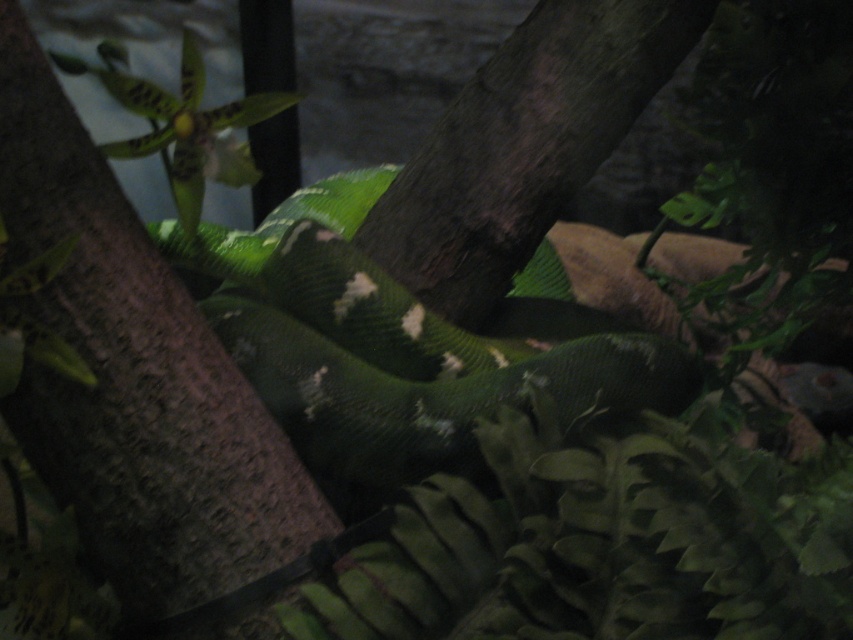
You are standing in front of a terrarium and notice a green snake coiled around a tree trunk. There is a point at coordinates (135, 376). What object is located at that point?

The point at coordinates (135, 376) is where the smooth brown tree trunk at center is located.

You are a zookeeper preparing to clean the terrarium. You need to know if the smooth brown tree trunk at center is wider than the green matte snake at center to decide the cleaning tool size. Which one is wider?

The green matte snake at center is wider than the smooth brown tree trunk at center because the description states that the tree trunk at center has a width less than the snake.

You are a zookeeper who needs to place a feeding dish between the smooth brown tree trunk at center and the green matte snake at center. The dish has a diameter of 30 centimeters. Can you fit the dish between them without moving either object?

The distance between the smooth brown tree trunk at center and the green matte snake at center is 52.31 centimeters. Since the dish has a diameter of 30 centimeters, which is smaller than the available space, you can fit the dish between them without moving either object.